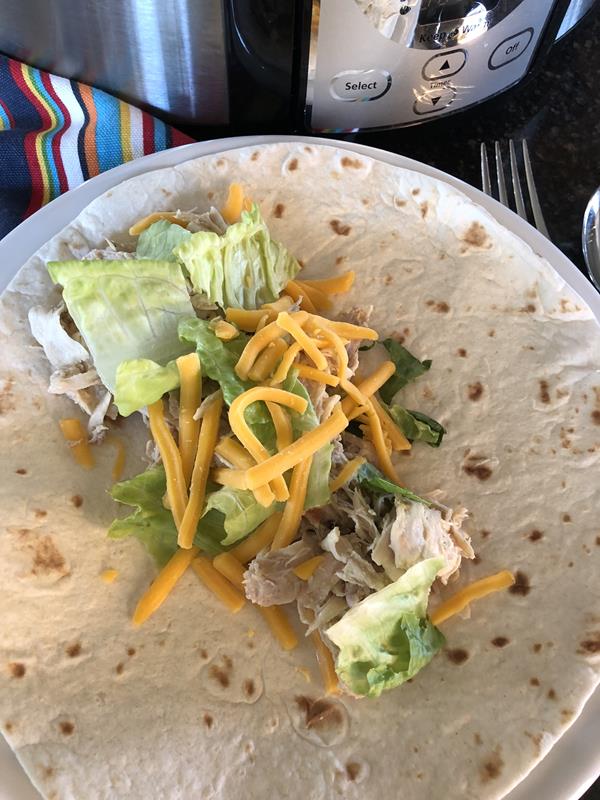
You are a GUI agent. You are given a task and a screenshot of the screen. Output one action in this format:
    pyautogui.click(x=<x>, y=<y>)
    Task: Click on the table
    
    Given the screenshot: What is the action you would take?
    pyautogui.click(x=567, y=130)